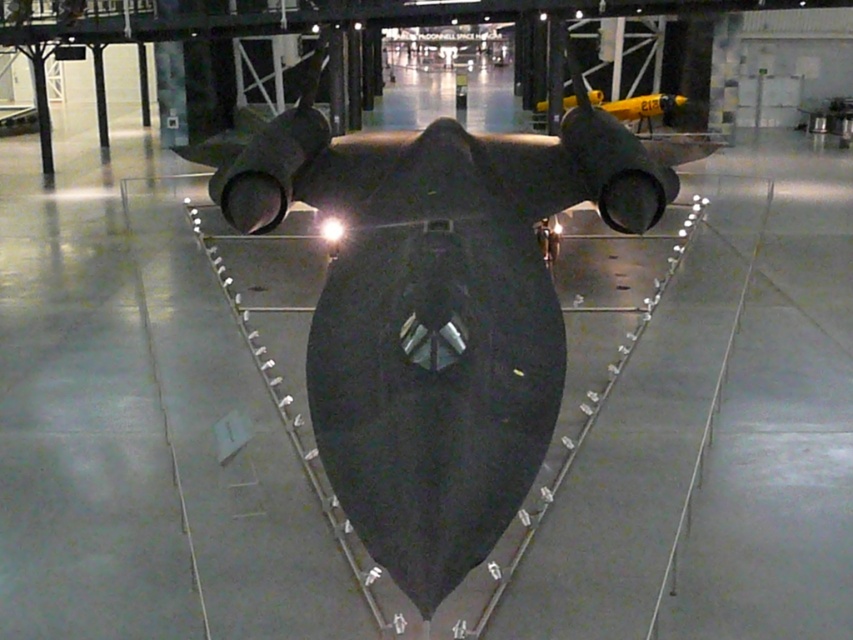
You are a security guard in the museum and need to ensure the matte black aircraft at center is visible from the entrance. The entrance is at the bottom left corner of the room. Is the aircraft positioned centrally enough to be seen from there without obstruction?

The matte black aircraft at center is located at point (437, 307), which is very close to the center of the room. Therefore, it should be visible from the entrance at the bottom left corner without significant obstruction.

You are a museum visitor standing at the entrance of the exhibit hall. You want to take a photo of the matte black aircraft at center without crossing the triangular barrier marked with evenly spaced lights. Can you determine if the point where the aircraft is located, point (437, 307), is inside the barrier perimeter?

The matte black aircraft at center is located at point (437, 307), which is within the triangular barrier perimeter. Therefore, the aircraft is safely enclosed within the barrier, and you can take the photo without crossing the barrier.

You are a museum visitor standing in front of the exhibit. You want to take a photo of the matte black aircraft at center and the yellow matte airplane at upper center. Which one should you focus on first if you want to capture both in the frame without moving your camera?

You should focus on the matte black aircraft at center first because it is positioned to the left of the yellow matte airplane at upper center, so capturing it first ensures both are in the frame without needing to adjust the camera position.